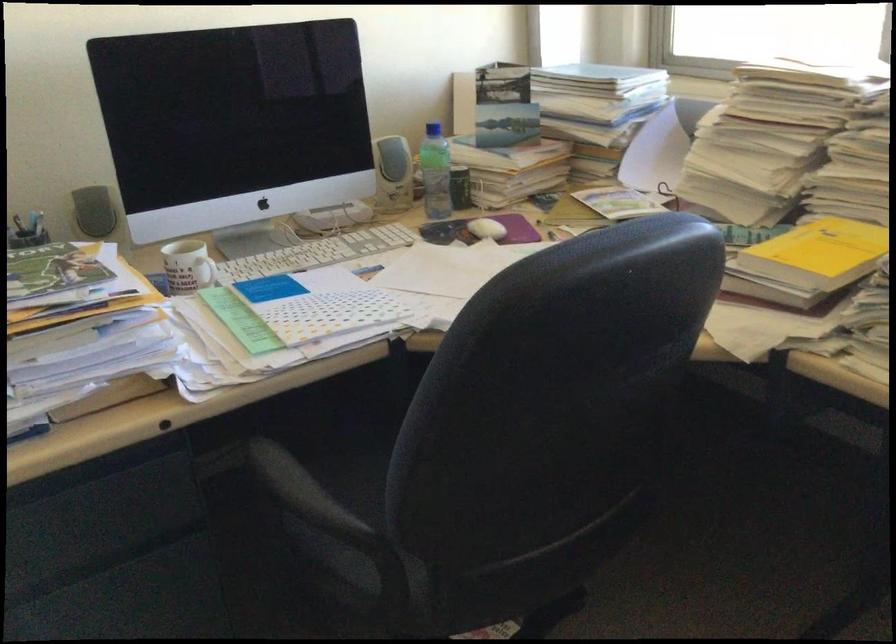
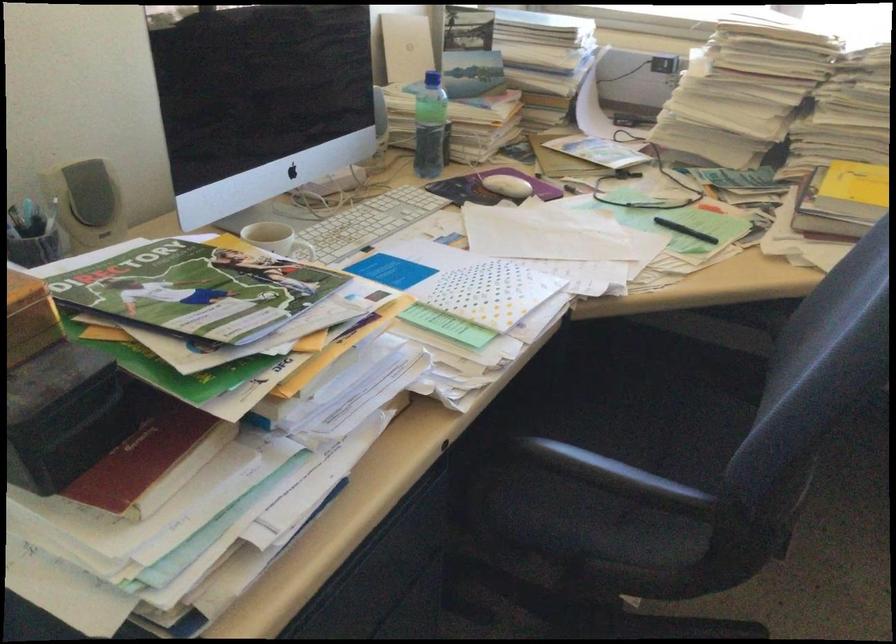
The point at (202,267) is marked in the first image. Where is the corresponding point in the second image?

(306, 252)